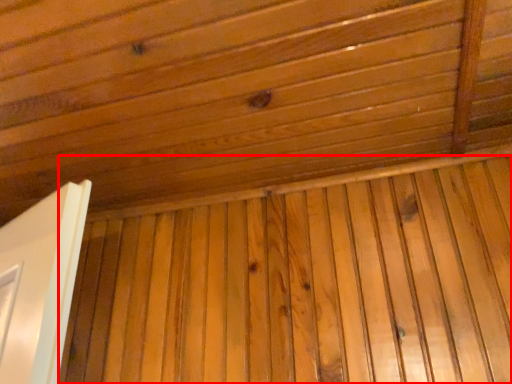
Question: Where is plywood (annotated by the red box) located in relation to roof in the image?

Choices:
 (A) right
 (B) left

Answer: (A)